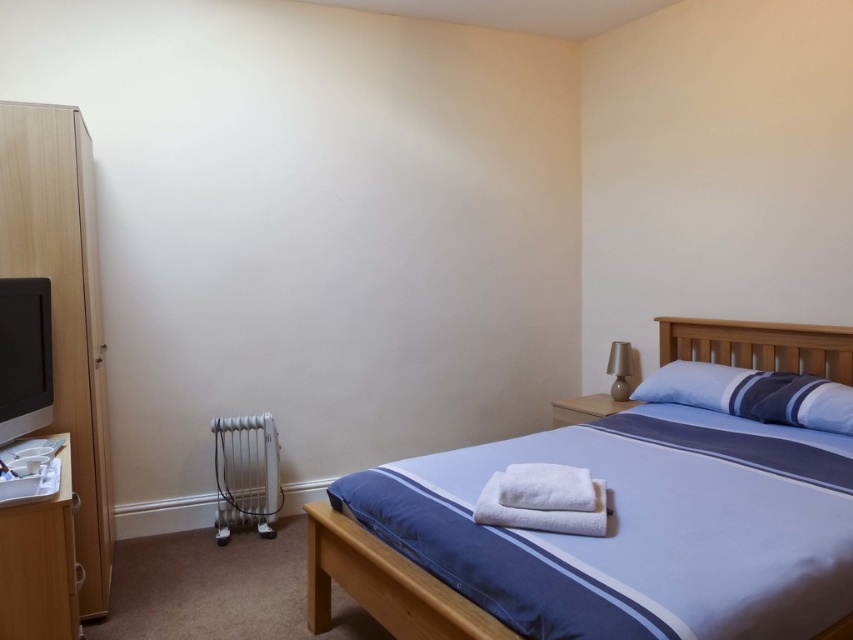
Who is higher up, light wood dresser at left or matte beige lamp at upper right?

Positioned higher is light wood dresser at left.

Based on the photo, does light wood dresser at left have a smaller size compared to matte beige lamp at upper right?

No, light wood dresser at left is not smaller than matte beige lamp at upper right.

Who is more forward, (107, 440) or (612, 346)?

Point (107, 440)

You are a GUI agent. You are given a task and a screenshot of the screen. Output one action in this format:
    pyautogui.click(x=<x>, y=<y>)
    Task: Click on the light wood dresser at left
    The width and height of the screenshot is (853, 640).
    Given the screenshot: What is the action you would take?
    pyautogui.click(x=64, y=305)

Can you confirm if light wood dresser at left is positioned below blue fabric pillow at upper right?

No, light wood dresser at left is not below blue fabric pillow at upper right.

Can you confirm if light wood dresser at left is thinner than blue fabric pillow at upper right?

Correct, light wood dresser at left's width is less than blue fabric pillow at upper right's.

Is point (74, 131) more distant than point (845, 385)?

That is False.

The image size is (853, 640). What are the coordinates of `light wood dresser at left` in the screenshot? It's located at (64, 305).

Between blue fabric bed at center and matte black monitor at left, which one is positioned higher?

Positioned higher is blue fabric bed at center.

Which of these two, blue fabric bed at center or matte black monitor at left, stands taller?

matte black monitor at left

Between point (747, 356) and point (4, 291), which one is positioned in front?

Point (4, 291) is more forward.

This screenshot has height=640, width=853. I want to click on blue fabric bed at center, so click(384, 584).